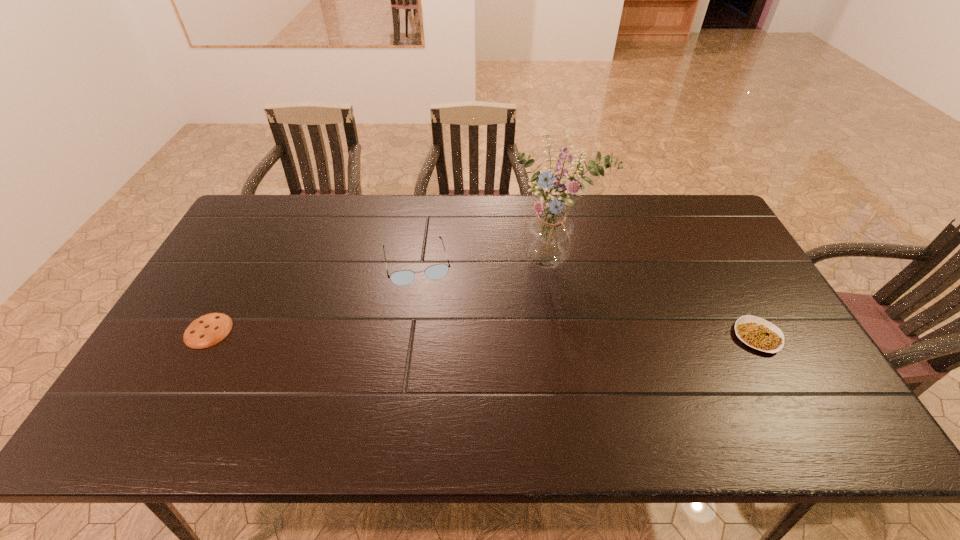
Where is `free point between the leftmost object and the third shortest object`? The image size is (960, 540). free point between the leftmost object and the third shortest object is located at coordinates coord(312,296).

Locate an element on the screen. free space between the cookie and the rightmost object is located at coordinates (483, 333).

Where is `free space between the legume and the bouquet`? free space between the legume and the bouquet is located at coordinates (656, 298).

Where is `object that can be found as the second closest to the bouquet`? The width and height of the screenshot is (960, 540). object that can be found as the second closest to the bouquet is located at coordinates (759, 334).

Identify which object is located as the third nearest to the legume. Please provide its 2D coordinates. Your answer should be formatted as a tuple, i.e. [(x, y)], where the tuple contains the x and y coordinates of a point satisfying the conditions above.

[(208, 330)]

Find the location of a particular element. Image resolution: width=960 pixels, height=540 pixels. vacant space that satisfies the following two spatial constraints: 1. on the front side of the legume; 2. on the left side of the bouquet is located at coordinates (567, 336).

Locate an element on the screen. vacant space that satisfies the following two spatial constraints: 1. on the back side of the shortest object; 2. on the right side of the third object from right to left is located at coordinates coord(246,263).